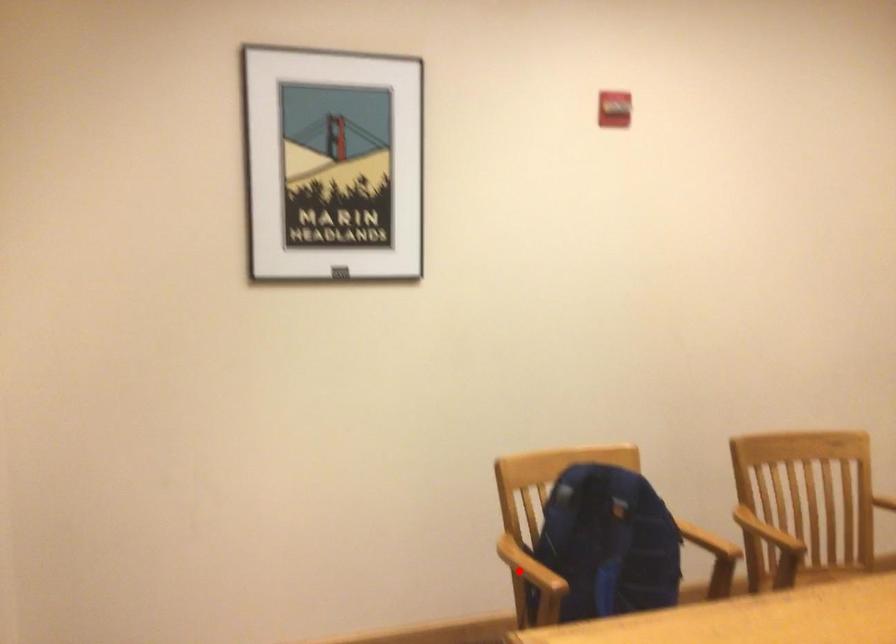
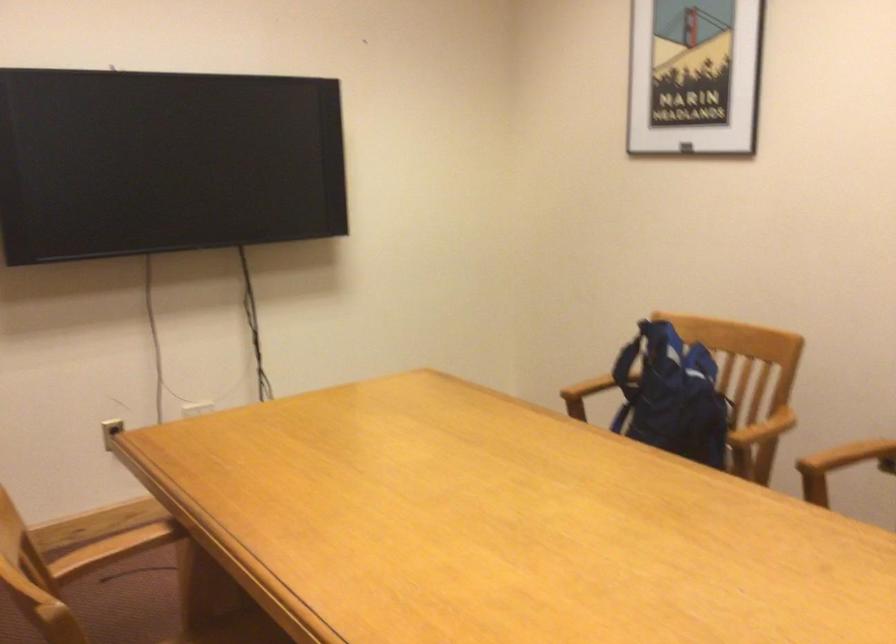
Question: I am providing you with two images of the same scene from different viewpoints. Given a red point in image1, look at the same physical point in image2. Is it:

Choices:
 (A) Closer to the viewpoint
 (B) Farther from the viewpoint

Answer: (B)